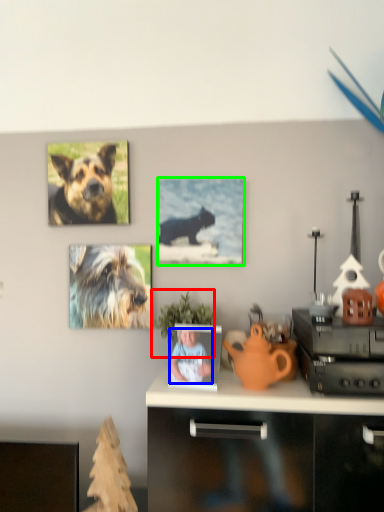
Question: Estimate the real-world distances between objects in this image. Which object is closer to houseplant (highlighted by a red box), person (highlighted by a blue box) or picture frame (highlighted by a green box)?

Choices:
 (A) person
 (B) picture frame

Answer: (A)